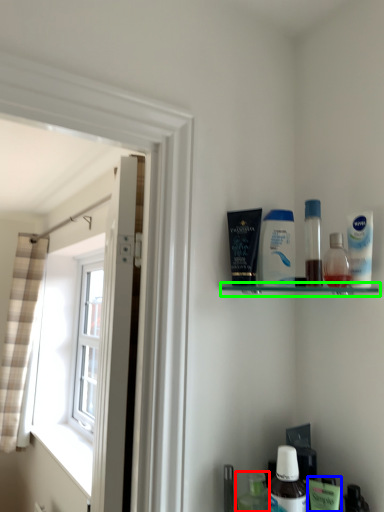
Question: Estimate the real-world distances between objects in this image. Which object is closer to toiletry (highlighted by a red box), mouthwash (highlighted by a blue box) or shelf (highlighted by a green box)?

Choices:
 (A) mouthwash
 (B) shelf

Answer: (A)